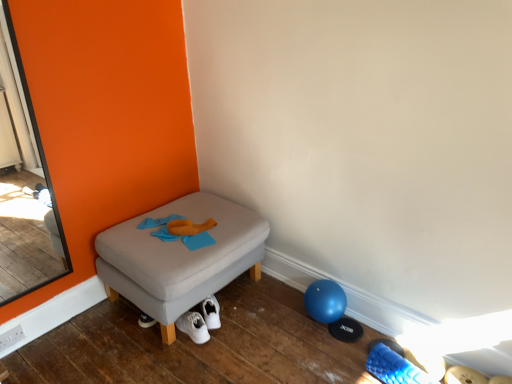
In order to click on spots to the right of matte gray ottoman at center in this screenshot , I will do `click(290, 328)`.